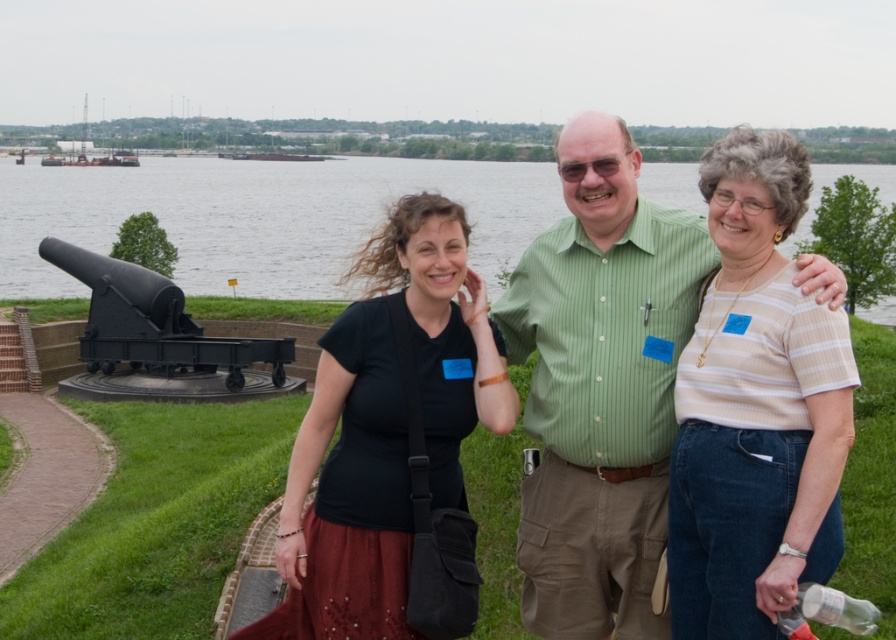
You are standing at the brick pathway leading to the cannon and want to take a photo with the person wearing the green striped shirt at center. To ensure both the cannon and the shirt are in the frame, should you position yourself to the left or right of the black matte cannon at lower left?

To include both the black matte cannon at lower left and the green striped shirt at center in your photo, you should position yourself to the right of the black matte cannon at lower left since the green striped shirt at center is located to its right.

You are a photographer planning to take a group photo of the two subjects in the scene. The green striped shirt at center and the black matte cannon at lower left are in your frame. Considering their sizes, which one should you position closer to the camera to ensure both appear balanced in size in the final photo?

The green striped shirt at center might be wider than the black matte cannon at lower left, so to balance their sizes in the photo, you should position the black matte cannon at lower left closer to the camera since it is smaller and needs to appear larger in the frame.

Consider the image. You are standing in front of the cannon on the brick pathway. You want to take a photo of the green striped shirt at center and the black matte shirt at center. Which one is closer to you?

The black matte shirt at center is closer to you because the green striped shirt at center is behind it.